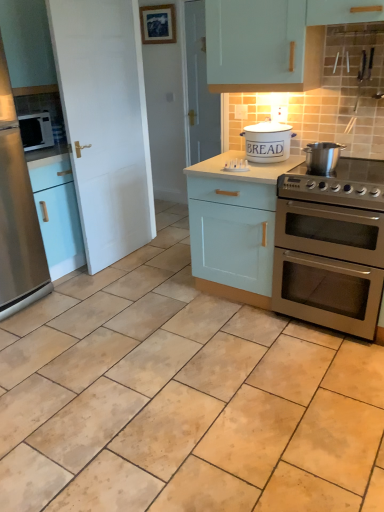
Where is `vacant region in front of satin silver oven at right`? The width and height of the screenshot is (384, 512). vacant region in front of satin silver oven at right is located at coordinates (325, 369).